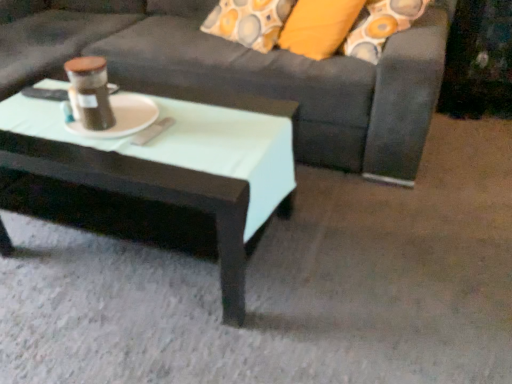
Question: Considering their positions, is matte brown jar at center located in front of or behind white matte platter at center?

Choices:
 (A) behind
 (B) front

Answer: (B)

Question: In terms of size, does matte brown jar at center appear bigger or smaller than white matte platter at center?

Choices:
 (A) small
 (B) big

Answer: (B)

Question: Estimate the real-world distances between objects in this image. Which object is closer to the dark gray fabric couch at center?

Choices:
 (A) white matte platter at center
 (B) matte black coffee table at center
 (C) matte brown jar at center

Answer: (B)

Question: Which object is positioned closest to the matte black coffee table at center?

Choices:
 (A) dark gray fabric couch at center
 (B) matte brown jar at center
 (C) white matte platter at center

Answer: (C)